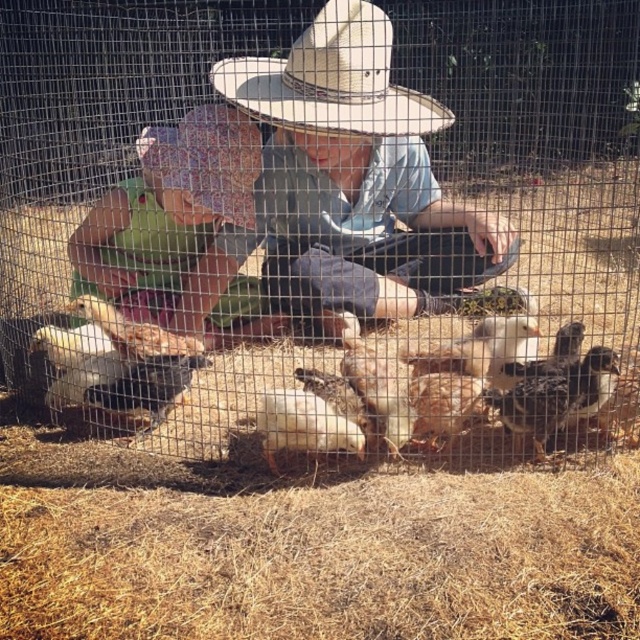
Question: Among these points, which one is nearest to the camera?

Choices:
 (A) (266, 435)
 (B) (353, 81)
 (C) (422, 259)

Answer: (A)

Question: Which point appears farthest from the camera in this image?

Choices:
 (A) (102, 234)
 (B) (401, 93)
 (C) (433, 109)

Answer: (B)

Question: Which point is farther to the camera?

Choices:
 (A) printed fabric hat at center
 (B) light brown straw hat at center
 (C) white feathered chicken at center

Answer: (A)

Question: Can you confirm if white fluffy chicken at center is positioned to the right of white feathered chicken at center?

Choices:
 (A) yes
 (B) no

Answer: (A)

Question: Is light brown straw hat at center positioned at the back of beige straw cowboy hat at center?

Choices:
 (A) no
 (B) yes

Answer: (B)

Question: Does beige straw cowboy hat at center appear on the left side of white feathered chicken at center?

Choices:
 (A) no
 (B) yes

Answer: (A)